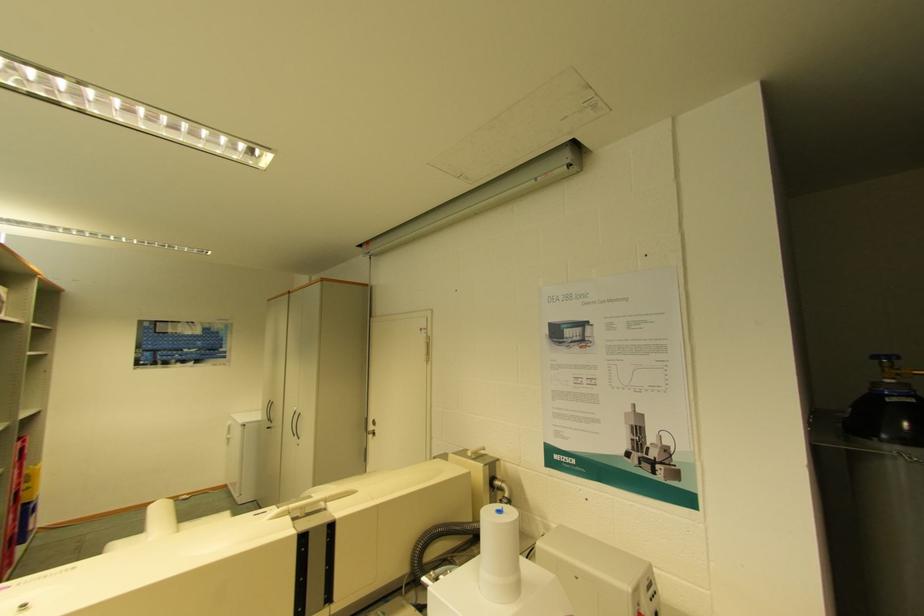
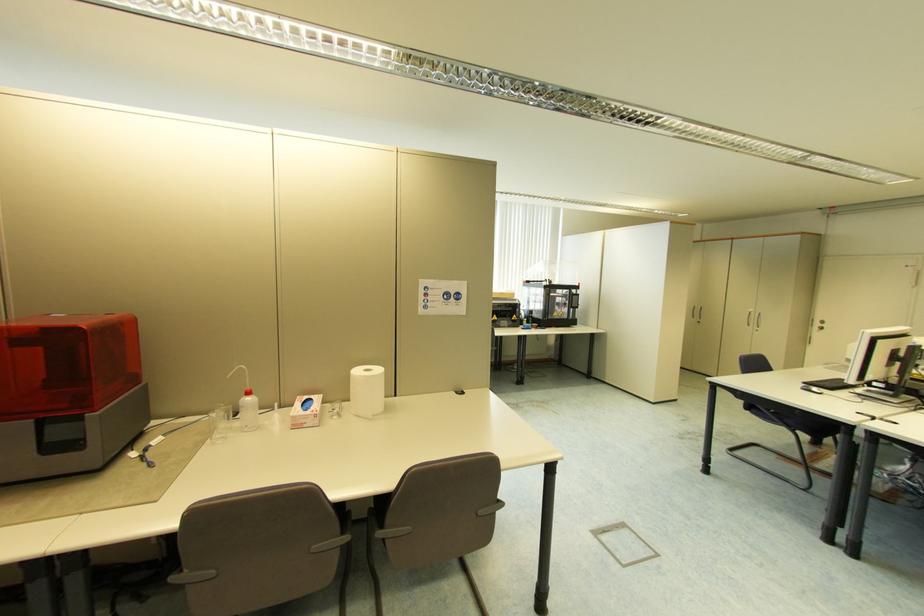
Locate, in the second image, the point that corresponds to (x=374, y=427) in the first image.

(821, 325)